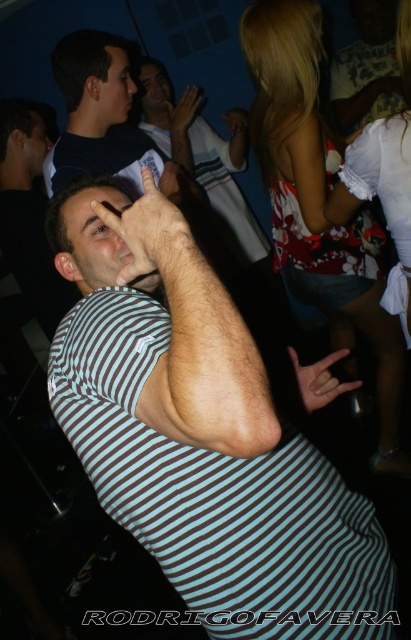
Question: Is matte black shirt at upper left wider than white matte hand at center?

Choices:
 (A) yes
 (B) no

Answer: (A)

Question: Can you confirm if striped shirt at center is thinner than matte skin hand at center?

Choices:
 (A) yes
 (B) no

Answer: (B)

Question: Among these points, which one is farthest from the camera?

Choices:
 (A) (30, 154)
 (B) (396, 92)

Answer: (B)

Question: Which of the following is the closest to the observer?

Choices:
 (A) floral fabric dress at upper right
 (B) black matte hand at center
 (C) matte black shirt at upper left

Answer: (B)

Question: In this image, where is matte black shirt at upper left located relative to matte skin hand at center?

Choices:
 (A) above
 (B) below

Answer: (B)

Question: Which object is the closest to the striped shirt at center?

Choices:
 (A) smooth skin face at center
 (B) white matte hand at center

Answer: (A)